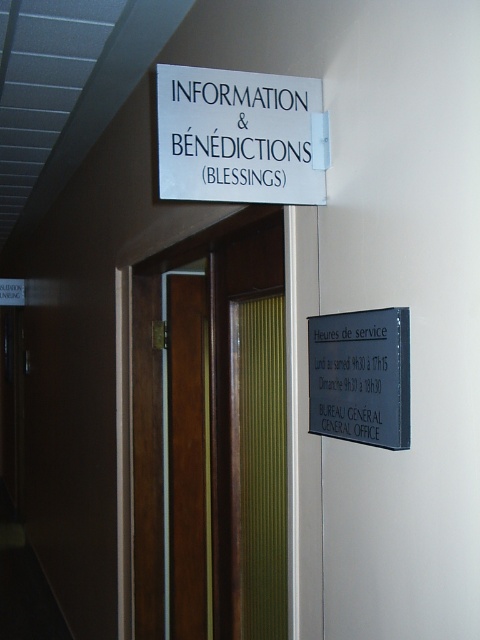
Question: Can you confirm if brown wood door at center is wider than white plastic sign at upper center?

Choices:
 (A) no
 (B) yes

Answer: (B)

Question: Which object is the farthest from the brown wood door at center?

Choices:
 (A) white plastic sign at upper center
 (B) metallic gray sign at right

Answer: (B)

Question: Which point appears closest to the camera in this image?

Choices:
 (A) (162, 122)
 (B) (211, 301)

Answer: (A)

Question: Is brown wood door at center thinner than metallic gray sign at right?

Choices:
 (A) no
 (B) yes

Answer: (A)

Question: Which object is farther from the camera taking this photo?

Choices:
 (A) white plastic sign at upper center
 (B) brown wood door at center

Answer: (B)

Question: Is brown wood door at center above white plastic sign at upper center?

Choices:
 (A) yes
 (B) no

Answer: (B)